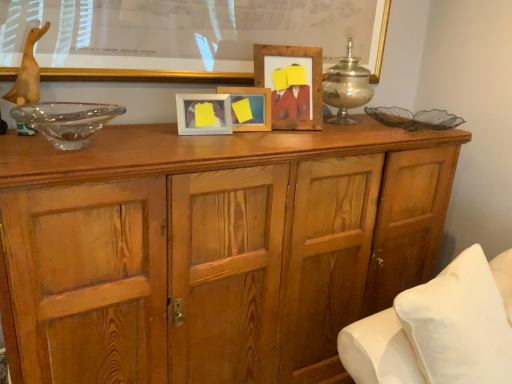
At what (x,y) coordinates should I click in order to perform the action: click on vacant area that is in front of wooden photo frame at center, which is the second picture frame in right-to-left order. Please return your answer as a coordinate pair (x, y). The image size is (512, 384). Looking at the image, I should click on (236, 128).